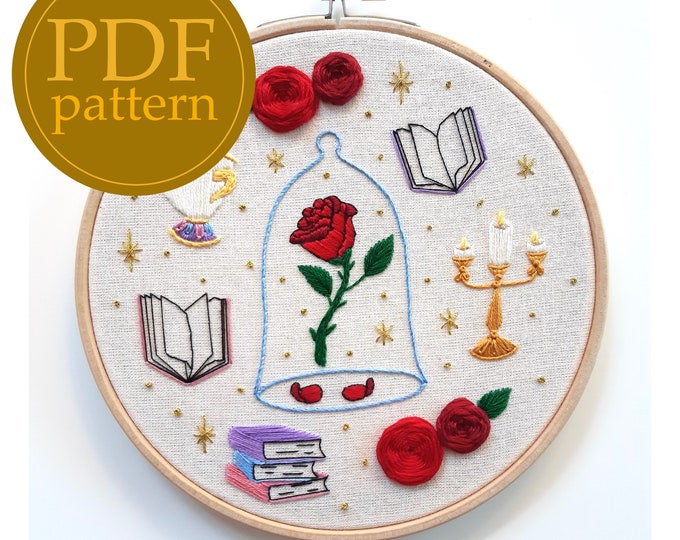
Image resolution: width=680 pixels, height=540 pixels. Identify the location of open book. (198, 339), (445, 148).